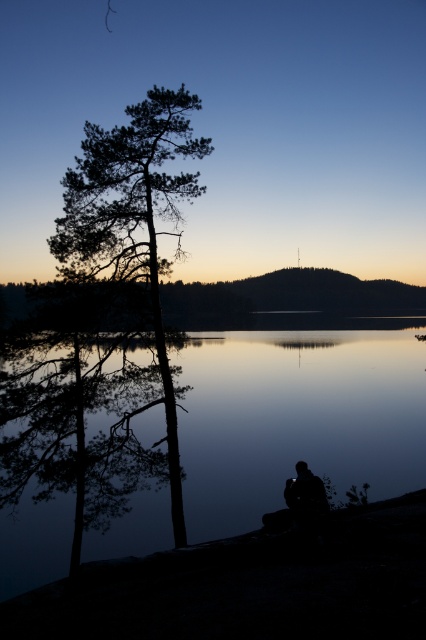
Measure the distance between silvery reflective water at center and dark green textured tree at left.

silvery reflective water at center and dark green textured tree at left are 6.68 meters apart from each other.

Identify the location of silvery reflective water at center. (296, 419).